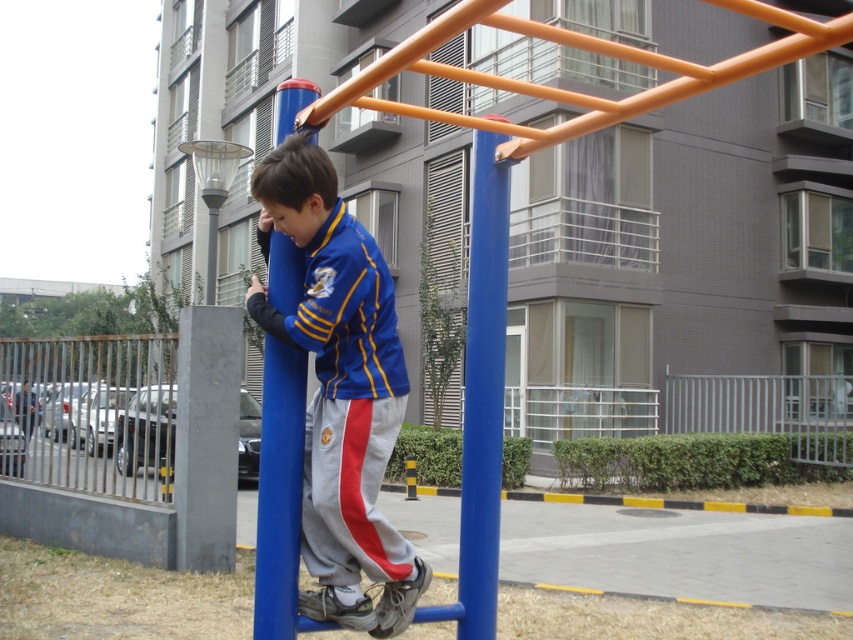
From the picture: Between blue fabric jacket at center and blue smooth pole at center, which one is positioned higher?

Positioned higher is blue smooth pole at center.

Who is more distant from viewer, (270, 214) or (474, 308)?

The point (474, 308) is behind.

This screenshot has width=853, height=640. Find the location of `blue fabric jacket at center`. blue fabric jacket at center is located at coordinates (340, 390).

Does blue smooth pole at center lie in front of blue plastic pole at center?

That is False.

Is point (473, 378) farther from viewer compared to point (271, 352)?

Yes.

The height and width of the screenshot is (640, 853). Find the location of `blue smooth pole at center`. blue smooth pole at center is located at coordinates (482, 392).

At what (x,y) coordinates should I click in order to perform the action: click on blue smooth pole at center. Please return your answer as a coordinate pair (x, y). Looking at the image, I should click on (482, 392).

Consider the image. Can you confirm if blue fabric jacket at center is positioned below blue plastic pole at center?

No, blue fabric jacket at center is not below blue plastic pole at center.

Can you confirm if blue fabric jacket at center is positioned to the right of blue plastic pole at center?

Correct, you'll find blue fabric jacket at center to the right of blue plastic pole at center.

Is point (374, 544) less distant than point (306, 378)?

That is True.

The height and width of the screenshot is (640, 853). I want to click on blue fabric jacket at center, so click(x=340, y=390).